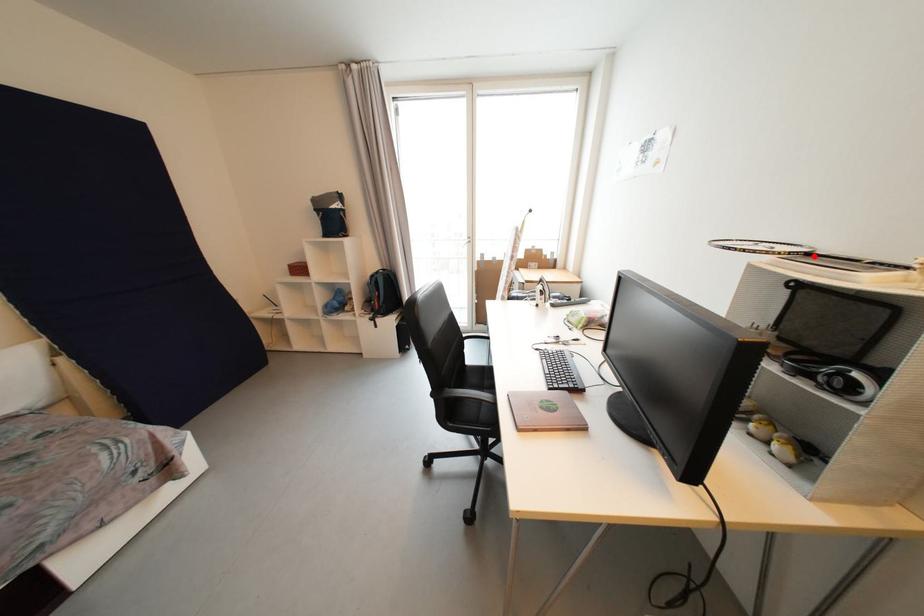
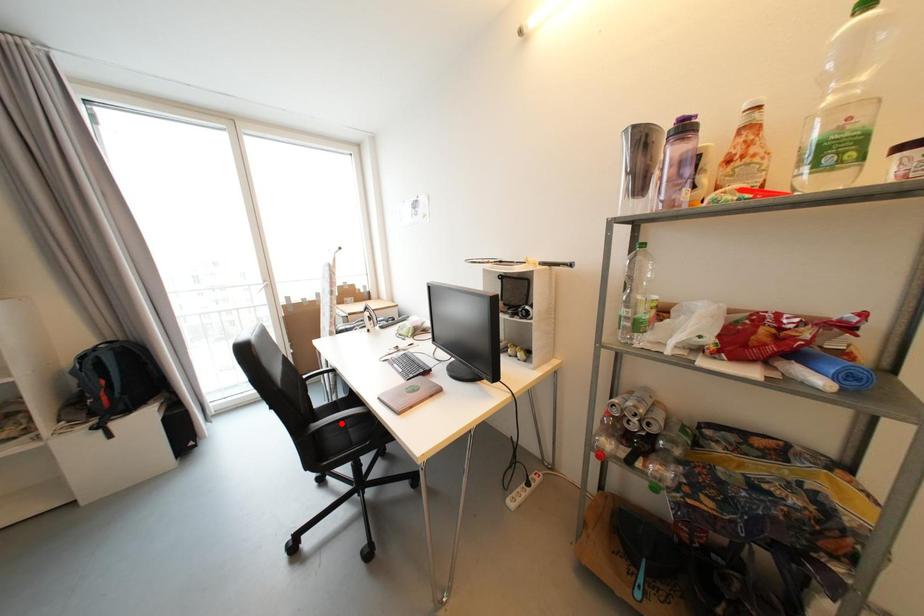
Based on the photo, I am providing you with two images of the same scene from different viewpoints. A red point is marked on the first image and another point is marked on the second image. Is the red point in image1 aligned with the point shown in image2?

No